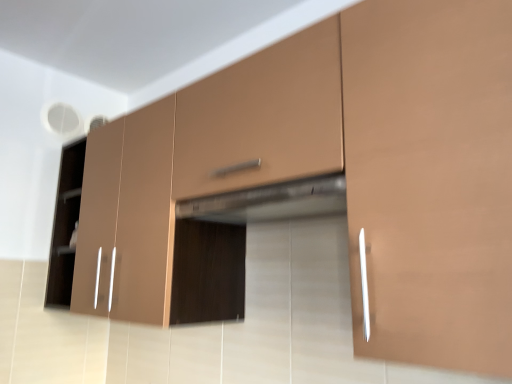
Question: Is point (325, 72) positioned closer to the camera than point (461, 150)?

Choices:
 (A) closer
 (B) farther

Answer: (B)

Question: Relative to matte brown cabinet at right, the first cabinetry in the front-to-back sequence, is matte brown drawer at center in front or behind?

Choices:
 (A) front
 (B) behind

Answer: (B)

Question: Which of these objects is positioned closest to the matte brown drawer at center?

Choices:
 (A) satin metallic exhaust hood at center
 (B) matte brown cabinet at right, which ranks as the first cabinetry in right-to-left order
 (C) matte brown cabinet at center, arranged as the first cabinetry when viewed from the left

Answer: (A)

Question: Which is nearer to the matte brown cabinet at right, the first cabinetry in the front-to-back sequence?

Choices:
 (A) matte brown drawer at center
 (B) satin metallic exhaust hood at center
 (C) matte brown cabinet at center, the second cabinetry when ordered from front to back

Answer: (A)